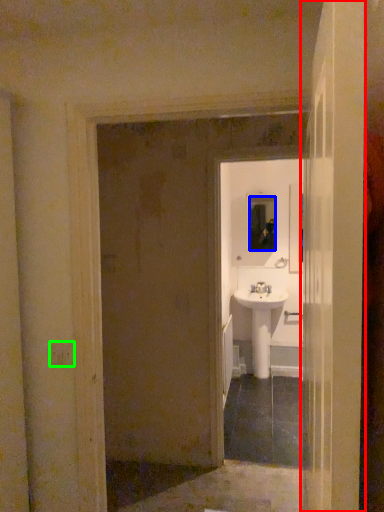
Question: Estimate the real-world distances between objects in this image. Which object is farther from door (highlighted by a red box), mirror (highlighted by a blue box) or light switch (highlighted by a green box)?

Choices:
 (A) mirror
 (B) light switch

Answer: (A)